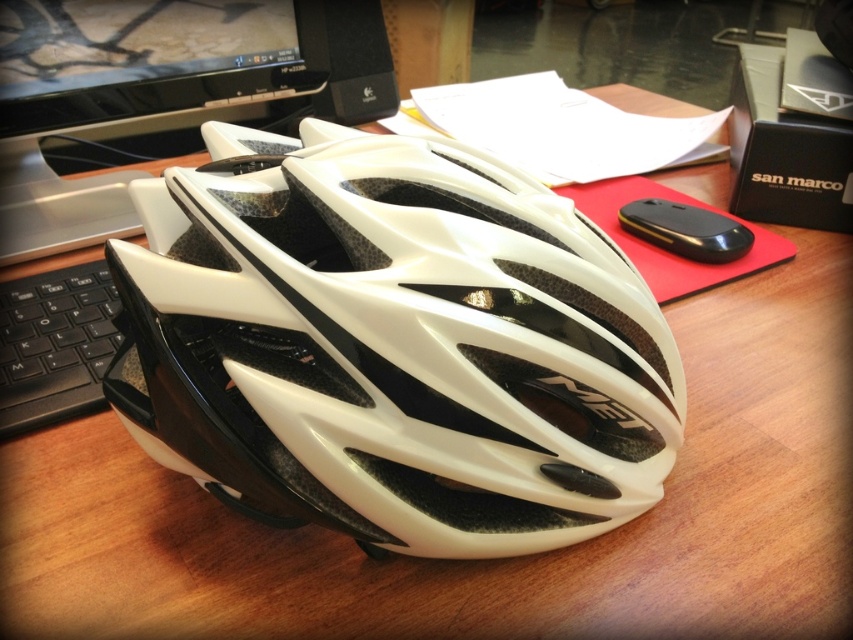
Question: Which object appears farthest from the camera in this image?

Choices:
 (A) white matte computer at upper left
 (B) black plastic keyboard at left

Answer: (A)

Question: Is white matte helmet at center in front of white matte computer at upper left?

Choices:
 (A) no
 (B) yes

Answer: (B)

Question: Does white matte helmet at center appear over white matte computer at upper left?

Choices:
 (A) yes
 (B) no

Answer: (B)

Question: Is white matte computer at upper left thinner than black plastic keyboard at left?

Choices:
 (A) no
 (B) yes

Answer: (A)

Question: Based on their relative distances, which object is farther from the white matte computer at upper left?

Choices:
 (A) black plastic keyboard at left
 (B) white matte helmet at center

Answer: (B)

Question: Which point is farther to the camera?

Choices:
 (A) white matte helmet at center
 (B) black plastic keyboard at left
 (C) white matte computer at upper left

Answer: (C)